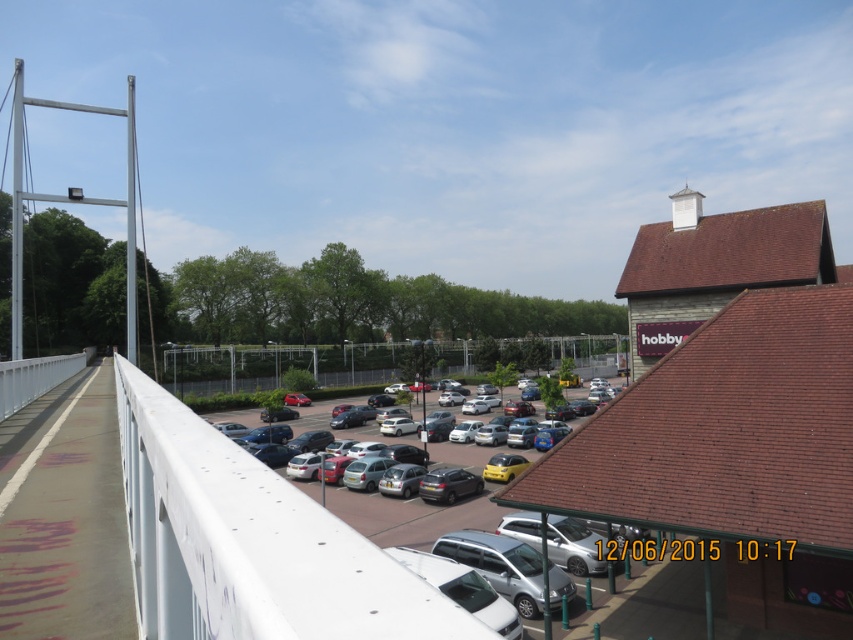
Question: Which object is farther from the camera taking this photo?

Choices:
 (A) metallic silver cars at center
 (B) silver metallic van at center
 (C) silver metallic hatchback at center

Answer: (C)

Question: Does metallic silver cars at center appear over silver metallic van at center?

Choices:
 (A) yes
 (B) no

Answer: (B)

Question: Does silver metallic van at center have a larger size compared to silver metallic hatchback at center?

Choices:
 (A) no
 (B) yes

Answer: (A)

Question: Which point is farther to the camera?

Choices:
 (A) silver metallic hatchback at center
 (B) satin silver car at center
 (C) silver metallic van at center
 (D) metallic silver cars at center

Answer: (A)

Question: Among these points, which one is nearest to the camera?

Choices:
 (A) (445, 476)
 (B) (450, 445)
 (C) (519, 611)

Answer: (C)

Question: Is metallic silver cars at center bigger than satin silver car at center?

Choices:
 (A) no
 (B) yes

Answer: (B)